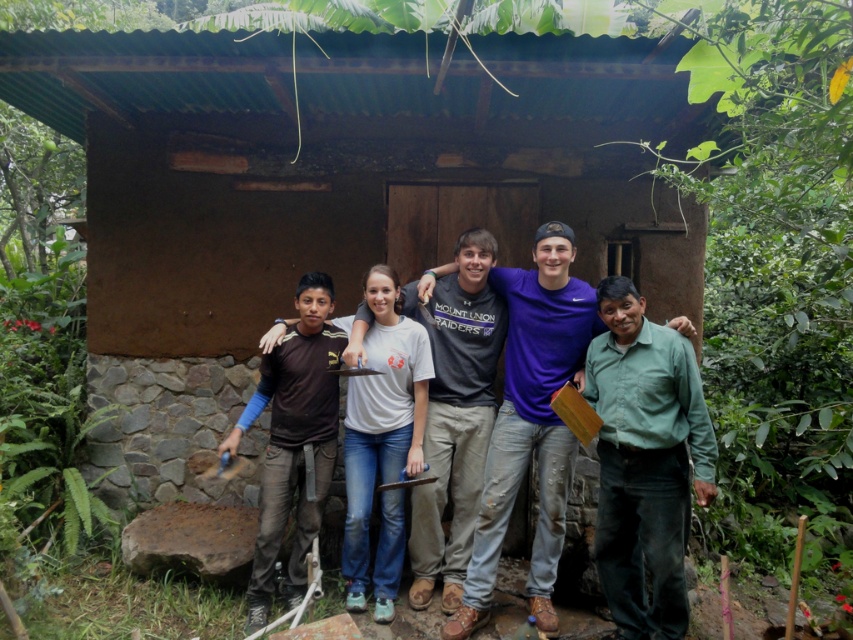
Question: Can you confirm if green cotton shirt at right is positioned below matte gray shirt at center?

Choices:
 (A) no
 (B) yes

Answer: (B)

Question: Can you confirm if green cotton shirt at right is wider than matte gray shirt at center?

Choices:
 (A) no
 (B) yes

Answer: (A)

Question: Can you confirm if green cotton shirt at right is bigger than matte gray shirt at center?

Choices:
 (A) no
 (B) yes

Answer: (A)

Question: Which point is closer to the camera?

Choices:
 (A) [x=518, y=364]
 (B) [x=619, y=493]

Answer: (B)